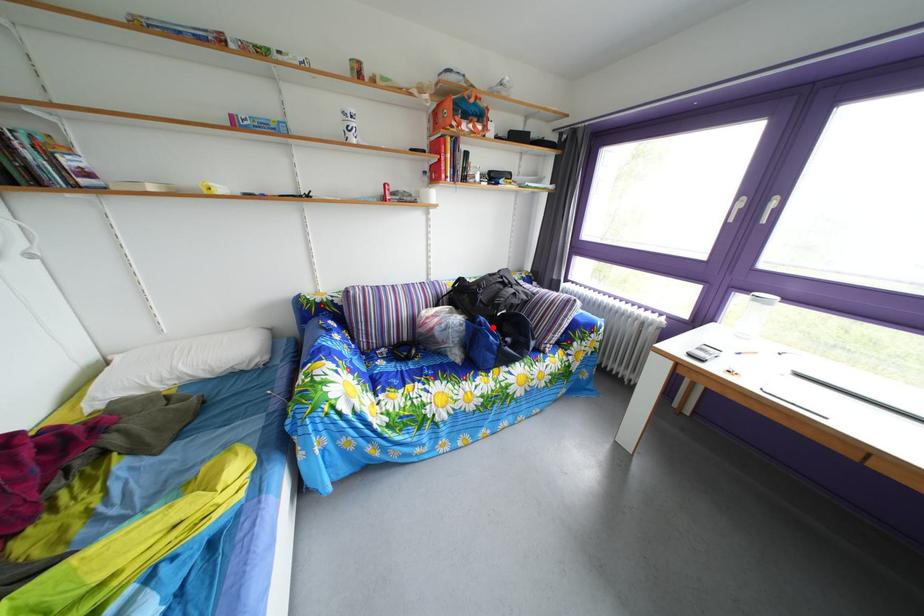
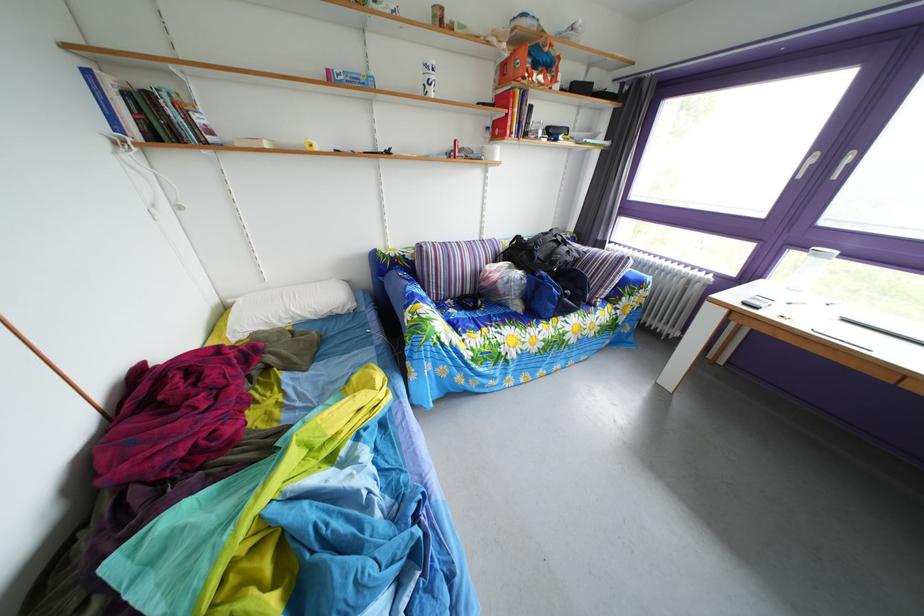
Where in the second image is the point corresponding to the highlighted location from the first image?

(553, 282)